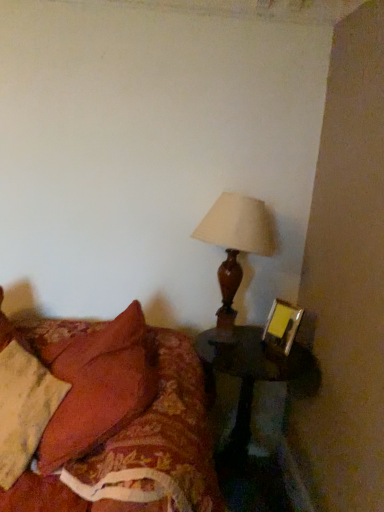
I want to click on vacant space to the left of matte gold picture frame at right, so click(x=257, y=354).